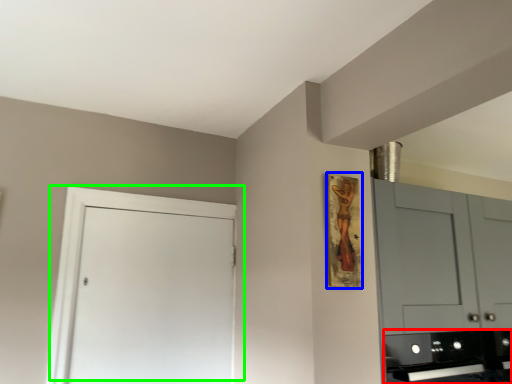
Question: Which object is the farthest from appliance (highlighted by a red box)? Choose among these: picture frame (highlighted by a blue box) or door (highlighted by a green box).

Choices:
 (A) picture frame
 (B) door

Answer: (B)